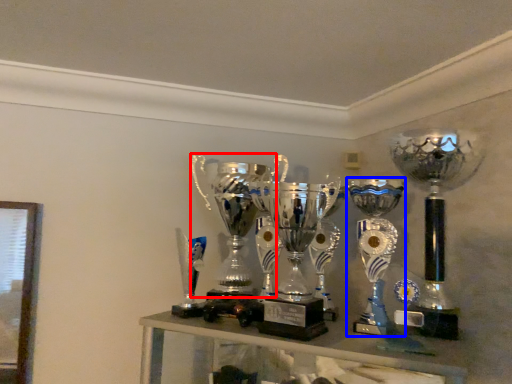
Question: Which object appears closest to the camera in this image, trophy (highlighted by a red box) or trophy (highlighted by a blue box)?

Choices:
 (A) trophy
 (B) trophy

Answer: (B)